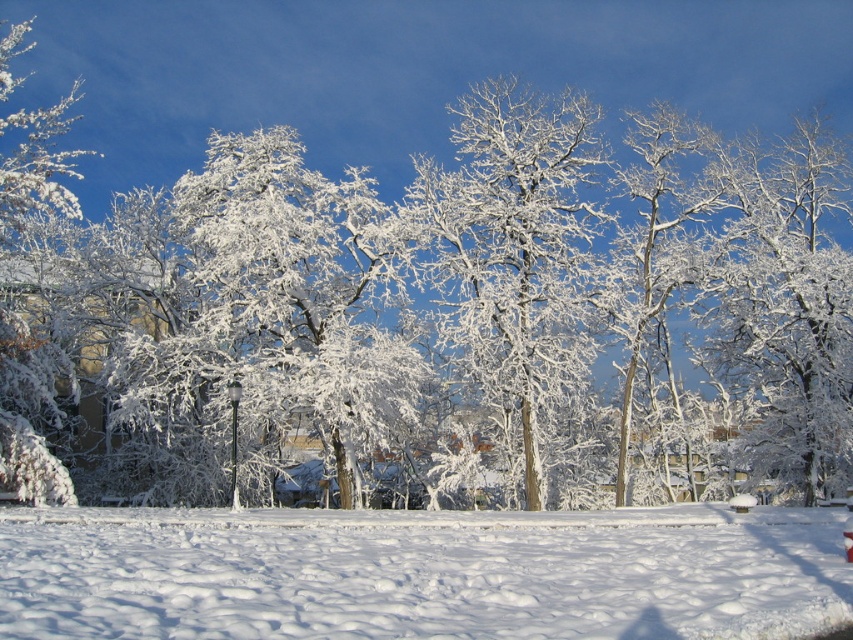
Question: From the image, what is the correct spatial relationship of white fluffy snow at lower center in relation to white frosty tree at center?

Choices:
 (A) right
 (B) left

Answer: (B)

Question: Which point is closer to the camera?

Choices:
 (A) white frosty tree at center
 (B) white fluffy snow at lower center
 (C) white frosty tree at upper right

Answer: (B)

Question: Is white frosty tree at center below white frosty tree at upper right?

Choices:
 (A) no
 (B) yes

Answer: (A)

Question: Which object appears closest to the camera in this image?

Choices:
 (A) white frosty tree at center
 (B) white frosty tree at upper right

Answer: (A)

Question: Which object is positioned closest to the white frosty tree at center?

Choices:
 (A) white frosty tree at upper right
 (B) white fluffy snow at lower center

Answer: (A)

Question: In this image, where is white fluffy snow at lower center located relative to white frosty tree at center?

Choices:
 (A) above
 (B) below

Answer: (B)